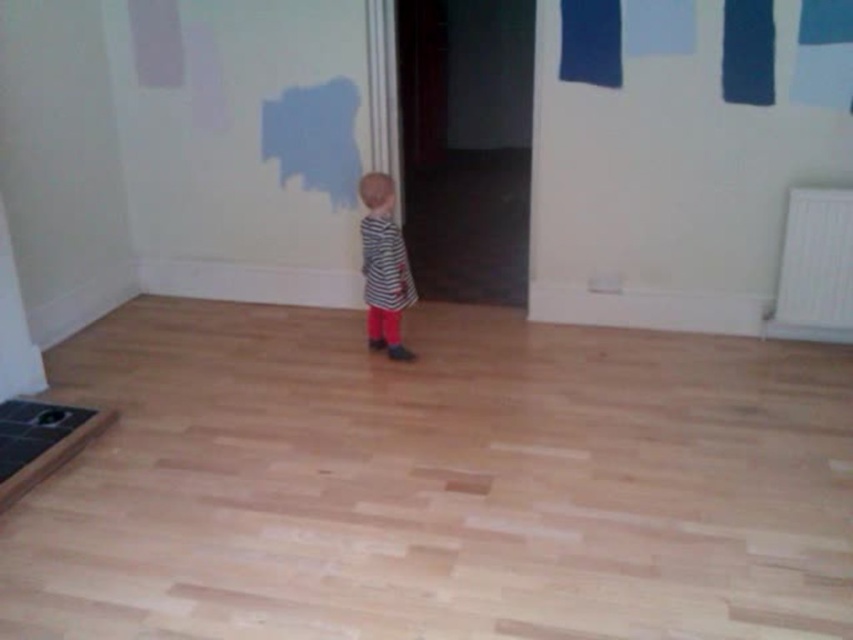
You are trying to navigate through the room while avoiding obstacles. There are two points marked in the room, point A at coordinates point (811, 243) and point B at coordinates point (379, 273). If you start at point B, which direction should you move to reach point A without going through the wall?

Result: To reach point A from point B, you should move backward since point A is behind point B.

You are an interior designer trying to place a new painting that is 30 cm wide. You want to hang it at the same position as the dark blue fabric at upper right. Can you confirm if the wall space at that coordinate is clear of any obstructions?

The dark blue fabric at upper right is located at coordinate point (x=619, y=35). Since there are no other objects mentioned at that specific location, the wall space there is clear for hanging the painting.